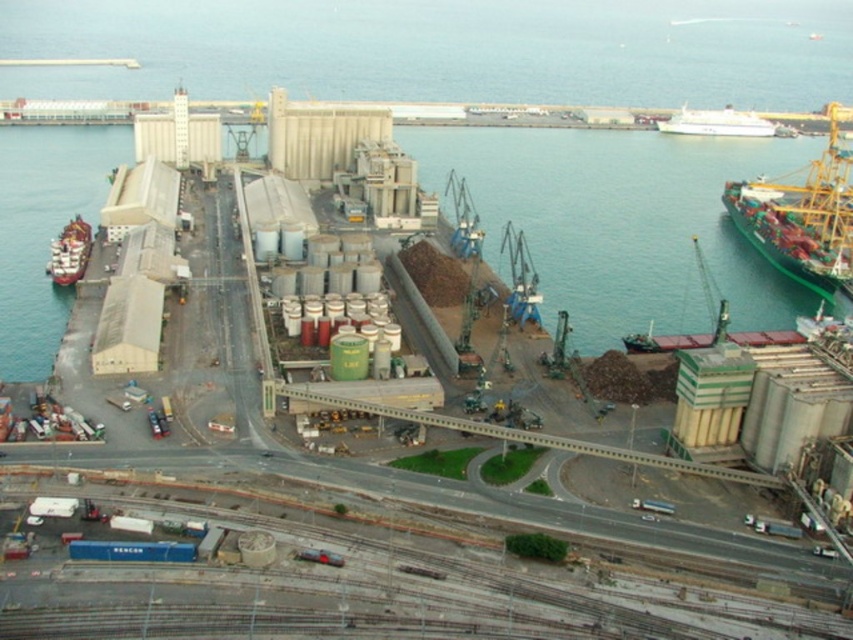
You are a port authority inspector examining the industrial port scene. You need to determine the visibility of the green matte cargo ship at upper right from the green metallic waterway at center. Based on their positions, is the cargo ship visible from the waterway? Please explain.

The green metallic waterway at center is closer to the viewer than the green matte cargo ship at upper right. Since the cargo ship is further away, it would likely be visible from the waterway as there are no obstructions mentioned in the scene description between them.

You are a port authority inspector and need to ensure safe navigation between the green metallic waterway at center and the white glossy ship at upper right. Based on their positions, which object is closer to the left side of the port area?

The green metallic waterway at center is closer to the left side of the port area because it is positioned to the left of the white glossy ship at upper right.

You are a port authority official planning to navigate a small boat through the green metallic waterway at center. Considering the position of the white glossy ship at upper right, will the waterway be obstructed by the ship?

The green metallic waterway at center is in front of the white glossy ship at upper right, meaning the ship is behind the waterway. Therefore, the waterway is not obstructed by the ship and remains navigable.